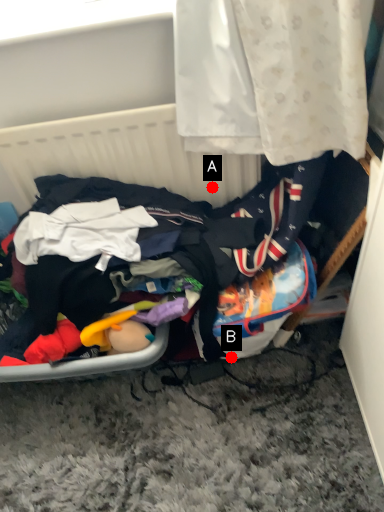
Question: Two points are circled on the image, labeled by A and B beside each circle. Which point is farther to the camera?

Choices:
 (A) A is further
 (B) B is further

Answer: (B)